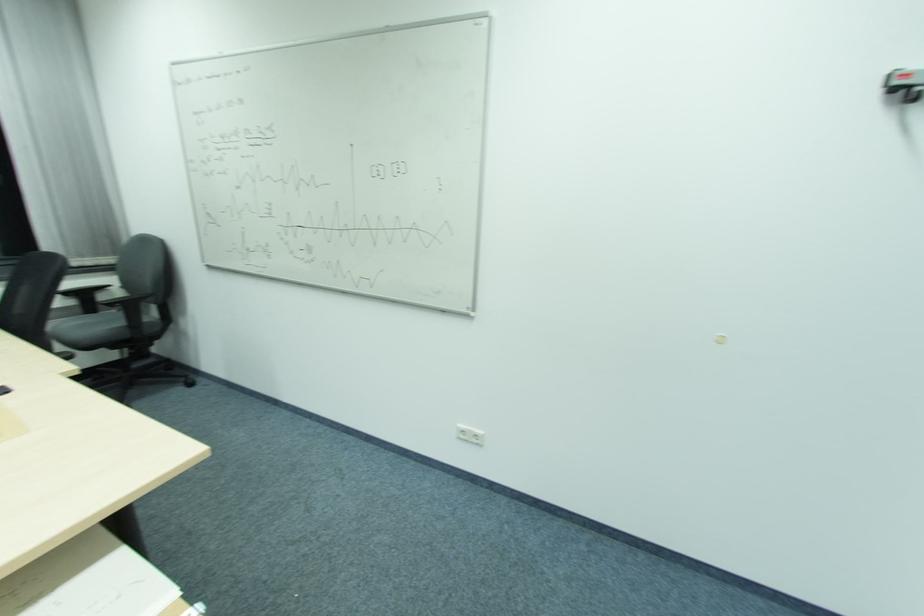
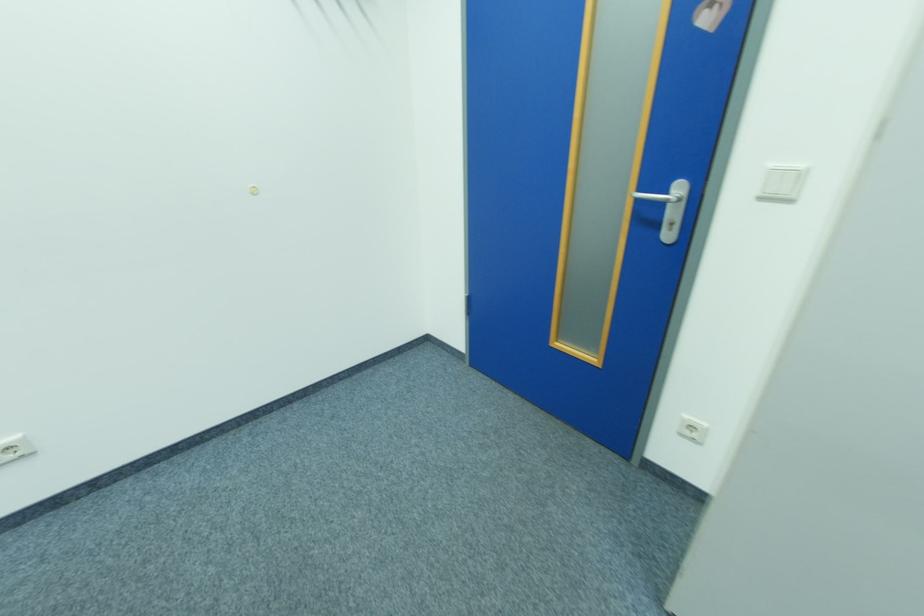
Looking at this image, the first image is from the beginning of the video and the second image is from the end. How did the camera likely rotate when shooting the video?

The camera rotated toward right-down.